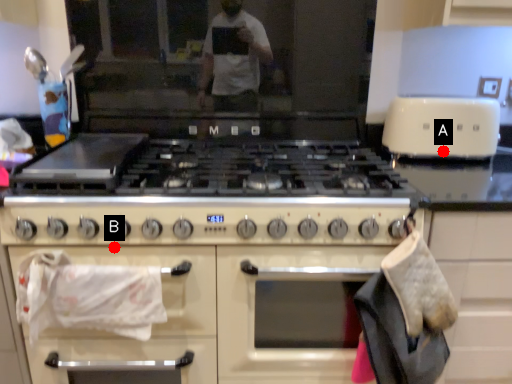
Question: Two points are circled on the image, labeled by A and B beside each circle. Which point is closer to the camera taking this photo?

Choices:
 (A) A is closer
 (B) B is closer

Answer: (B)